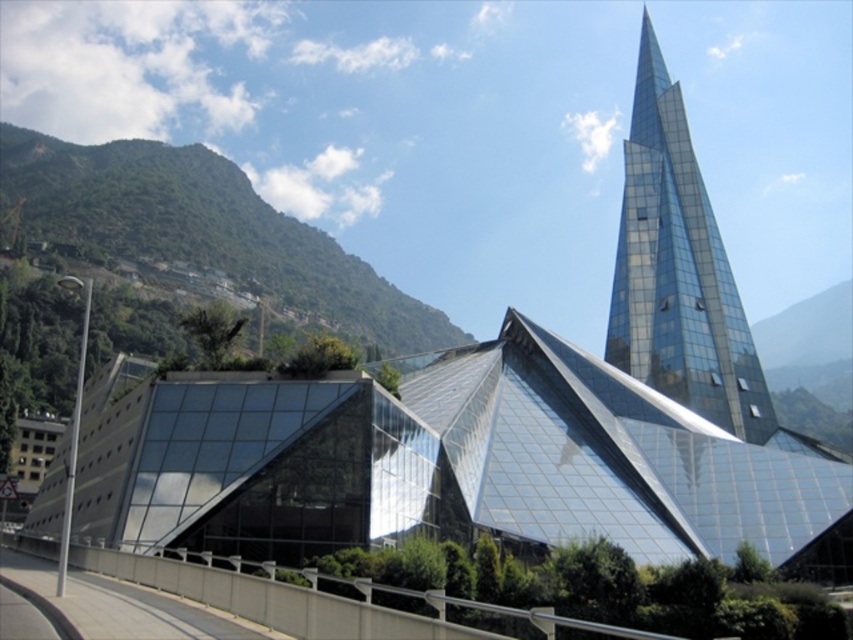
Question: Observing the image, what is the correct spatial positioning of transparent glass building at center in reference to transparent glass spire at upper right?

Choices:
 (A) right
 (B) left

Answer: (B)

Question: Which point is closer to the camera taking this photo?

Choices:
 (A) click(x=602, y=429)
 (B) click(x=675, y=387)

Answer: (A)

Question: Which of the following is the farthest from the observer?

Choices:
 (A) (643, 232)
 (B) (666, 438)

Answer: (A)

Question: Does transparent glass building at center have a larger size compared to transparent glass spire at upper right?

Choices:
 (A) yes
 (B) no

Answer: (B)

Question: Does transparent glass building at center appear under transparent glass spire at upper right?

Choices:
 (A) yes
 (B) no

Answer: (A)